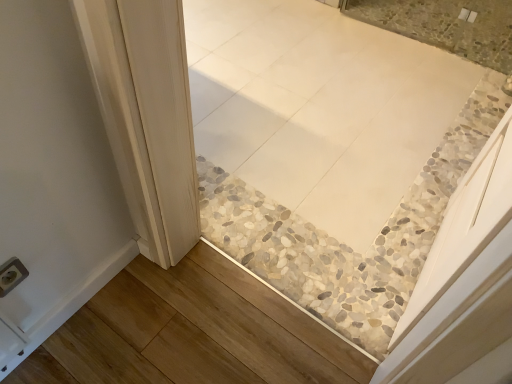
Question: In terms of height, does white glossy tile at upper center look taller or shorter compared to white plastic electric outlet at lower left?

Choices:
 (A) tall
 (B) short

Answer: (B)

Question: Is white glossy tile at upper center in front of or behind white plastic electric outlet at lower left in the image?

Choices:
 (A) front
 (B) behind

Answer: (B)

Question: Is white glossy tile at upper center bigger or smaller than white plastic electric outlet at lower left?

Choices:
 (A) small
 (B) big

Answer: (B)

Question: Is point (11, 263) closer or farther from the camera than point (369, 18)?

Choices:
 (A) closer
 (B) farther

Answer: (A)

Question: From the image's perspective, is white plastic electric outlet at lower left located above or below white glossy tile at upper center?

Choices:
 (A) below
 (B) above

Answer: (A)

Question: Looking at their shapes, would you say white plastic electric outlet at lower left is wider or thinner than white glossy tile at upper center?

Choices:
 (A) wide
 (B) thin

Answer: (B)

Question: From a real-world perspective, relative to white glossy tile at upper center, is white plastic electric outlet at lower left vertically above or below?

Choices:
 (A) below
 (B) above

Answer: (B)